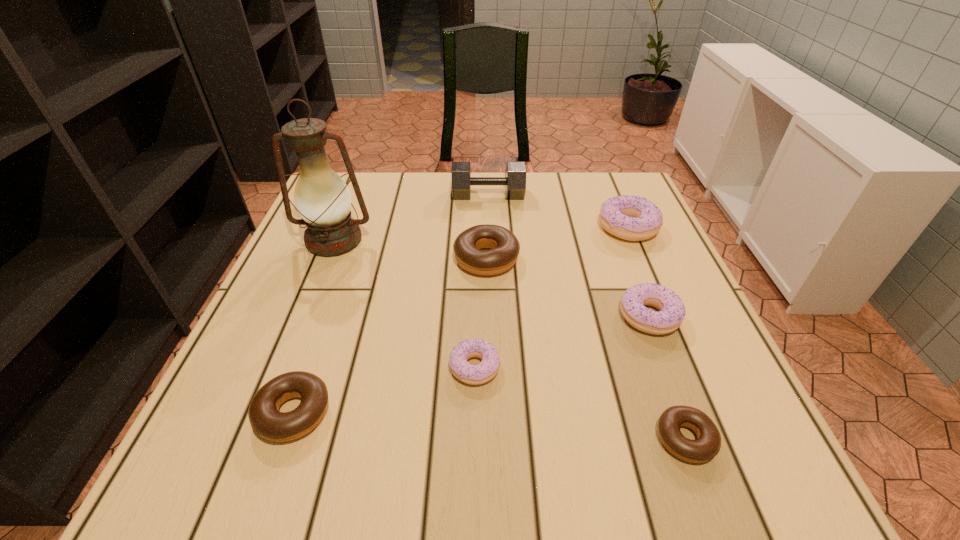
The width and height of the screenshot is (960, 540). In order to click on blank area located on the left of the rightmost brown doughnut in this screenshot , I will do `click(449, 439)`.

The image size is (960, 540). Identify the location of dumbbell present at the far edge. (515, 180).

The width and height of the screenshot is (960, 540). Find the location of `doughnut located at the far edge`. doughnut located at the far edge is located at coordinates (633, 218).

The image size is (960, 540). Identify the location of oil lamp that is positioned at the left edge. (x=322, y=198).

Image resolution: width=960 pixels, height=540 pixels. In order to click on doughnut that is at the left edge in this screenshot , I will do `click(265, 419)`.

The height and width of the screenshot is (540, 960). I want to click on object that is at the near left corner, so click(265, 419).

This screenshot has height=540, width=960. What are the coordinates of `object located at the far right corner` in the screenshot? It's located at (633, 218).

This screenshot has height=540, width=960. Find the location of `object at the near right corner`. object at the near right corner is located at coordinates (707, 445).

Identify the location of free space at the far edge of the desktop. This screenshot has height=540, width=960. (376, 219).

Find the location of `free spot at the near edge of the desktop`. free spot at the near edge of the desktop is located at coordinates (516, 488).